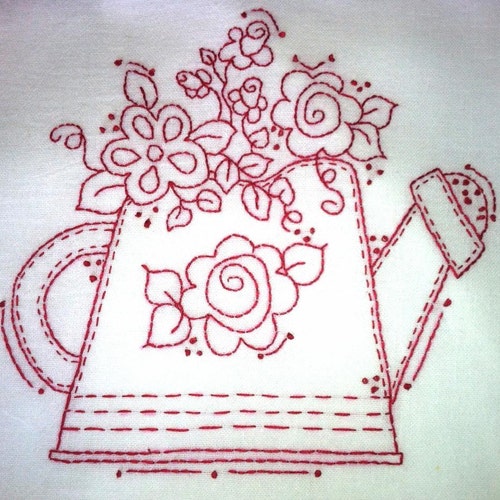
Where is `embroidered flower`? embroidered flower is located at coordinates (238, 287), (313, 106), (149, 154), (248, 93), (252, 27).